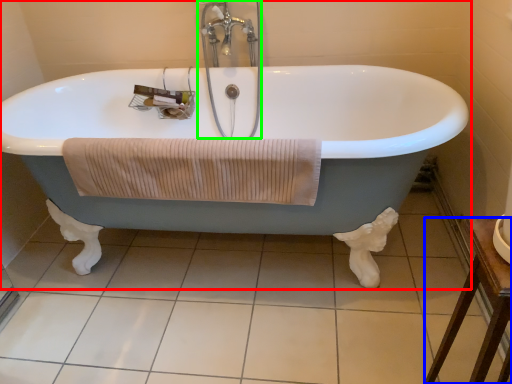
Question: Considering the real-world distances, which object is closest to bathtub (highlighted by a red box)? furniture (highlighted by a blue box) or faucet (highlighted by a green box).

Choices:
 (A) furniture
 (B) faucet

Answer: (B)